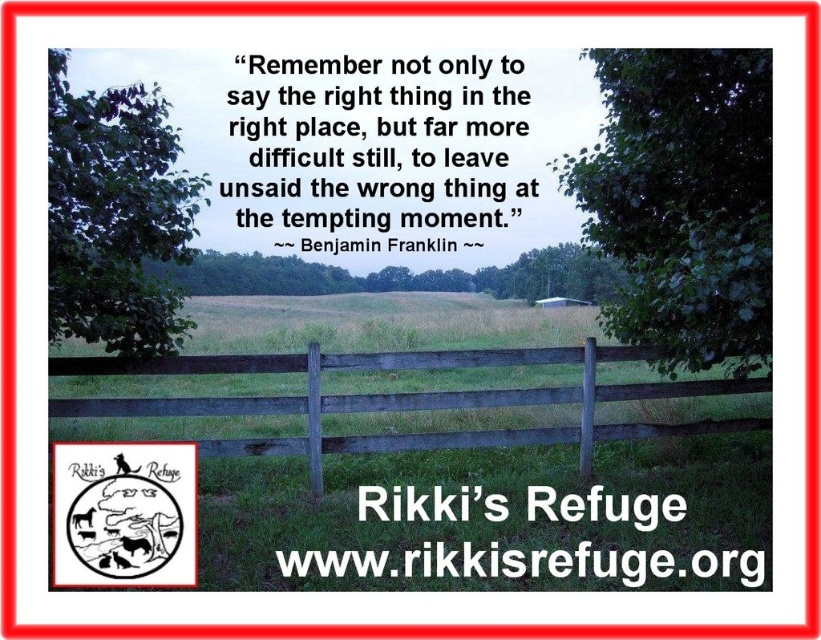
Who is lower down, green leafy tree at upper right or white paper at center?

white paper at center is lower down.

This screenshot has height=640, width=821. Find the location of `green leafy tree at upper right`. green leafy tree at upper right is located at coordinates (682, 202).

Does green leafy tree at upper left have a larger size compared to green leafy tree at center?

Yes.

Does green leafy tree at upper left appear on the right side of green leafy tree at center?

In fact, green leafy tree at upper left is to the left of green leafy tree at center.

The width and height of the screenshot is (821, 640). I want to click on green leafy tree at upper left, so click(x=115, y=216).

Between white paper at center and green leafy tree at center, which one is positioned lower?

white paper at center is lower down.

Based on the photo, who is more forward, (x=135, y=525) or (x=476, y=288)?

Point (x=135, y=525) is in front.

Image resolution: width=821 pixels, height=640 pixels. Identify the location of white paper at center. (124, 513).